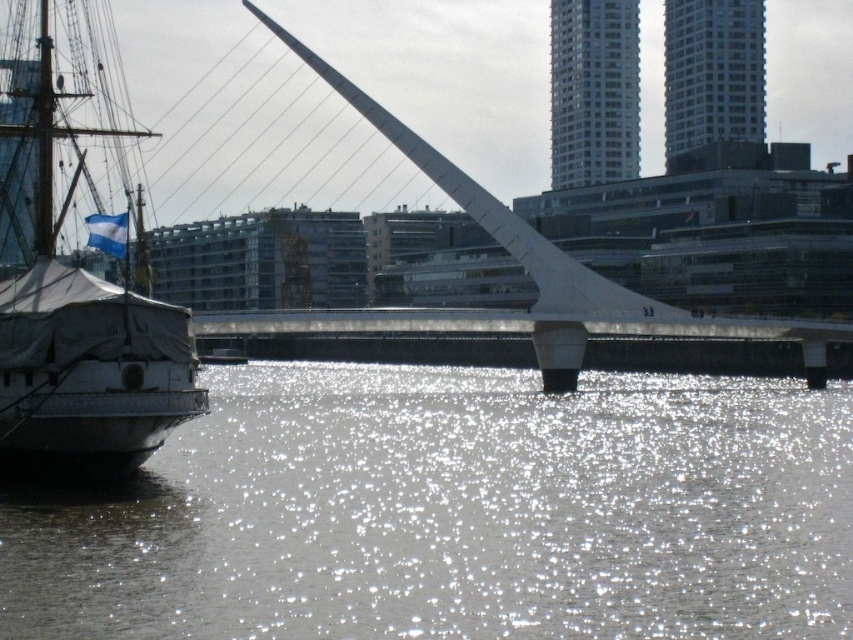
Does sparkling silver water at center have a lesser height compared to white canvas sailboat at left?

Indeed, sparkling silver water at center has a lesser height compared to white canvas sailboat at left.

Is sparkling silver water at center positioned behind white canvas sailboat at left?

No, sparkling silver water at center is closer to the viewer.

Is point (606, 552) positioned after point (62, 406)?

No, it is in front of (62, 406).

Locate an element on the screen. The width and height of the screenshot is (853, 640). sparkling silver water at center is located at coordinates (456, 513).